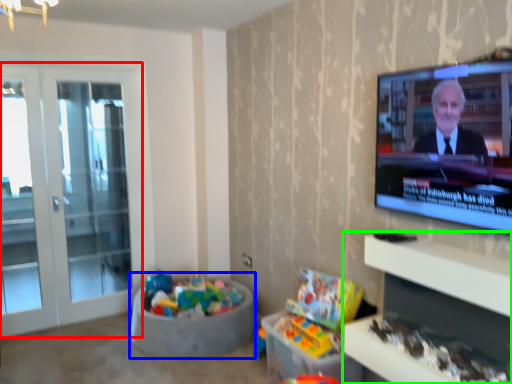
Question: Considering the real-world distances, which object is closest to screen door (highlighted by a red box)? bean bag chair (highlighted by a blue box) or entertainment center (highlighted by a green box).

Choices:
 (A) bean bag chair
 (B) entertainment center

Answer: (A)